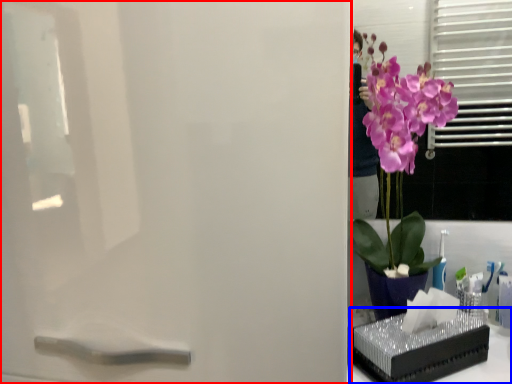
Question: Which point is closer to the camera, screen door (highlighted by a red box) or window sill (highlighted by a blue box)?

Choices:
 (A) screen door
 (B) window sill

Answer: (A)